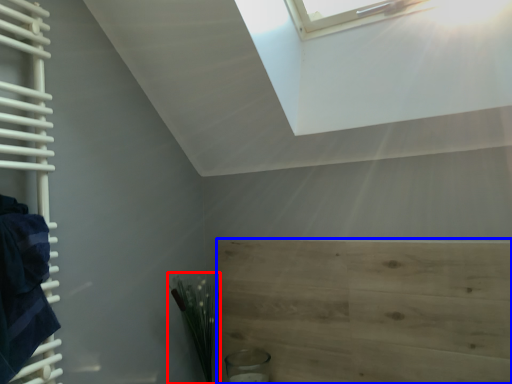
Question: Which object is further to the camera taking this photo, plant (highlighted by a red box) or plywood (highlighted by a blue box)?

Choices:
 (A) plant
 (B) plywood

Answer: (A)